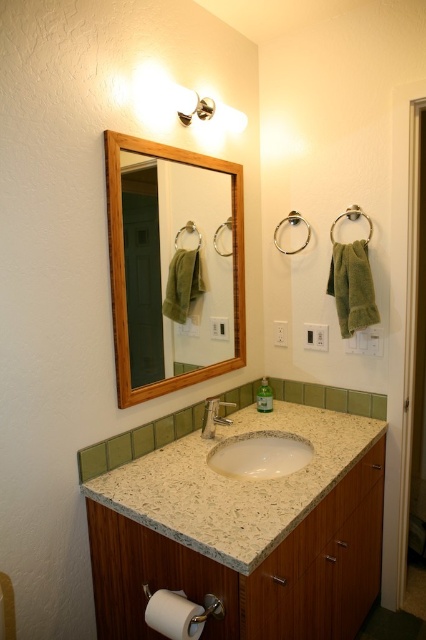
Is white speckled granite at center to the left of white granite sink at center from the viewer's perspective?

Incorrect, white speckled granite at center is not on the left side of white granite sink at center.

Is white speckled granite at center below white granite sink at center?

→ Actually, white speckled granite at center is above white granite sink at center.

The height and width of the screenshot is (640, 426). I want to click on white speckled granite at center, so (236, 484).

Is point (236, 234) positioned behind point (259, 385)?

No, it is in front of (259, 385).

Who is taller, wooden frame mirror at center or green matte soap dispenser at center?

wooden frame mirror at center

What do you see at coordinates (123, 266) in the screenshot?
I see `wooden frame mirror at center` at bounding box center [123, 266].

This screenshot has height=640, width=426. I want to click on wooden frame mirror at center, so click(123, 266).

Who is positioned more to the right, white speckled granite at center or wooden frame mirror at center?

white speckled granite at center

Looking at this image, who is shorter, white speckled granite at center or wooden frame mirror at center?

With less height is white speckled granite at center.

Is point (279, 499) positioned before point (112, 188)?

Yes.

This screenshot has height=640, width=426. In order to click on white speckled granite at center in this screenshot , I will do `click(236, 484)`.